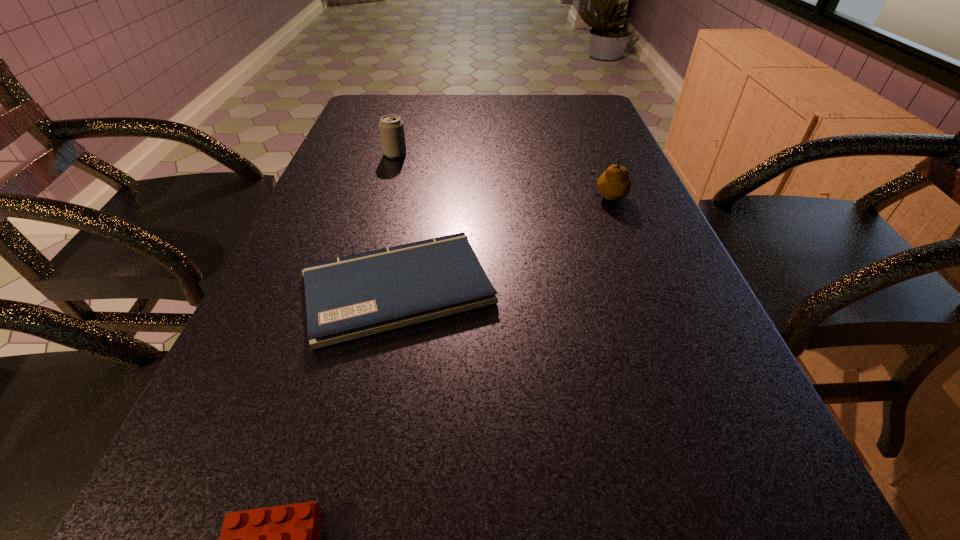
Where is `the farthest object`? The height and width of the screenshot is (540, 960). the farthest object is located at coordinates (391, 127).

Locate an element on the screen. This screenshot has width=960, height=540. the rightmost object is located at coordinates (614, 184).

Where is `the third nearest object`? Image resolution: width=960 pixels, height=540 pixels. the third nearest object is located at coordinates (614, 184).

The width and height of the screenshot is (960, 540). Identify the location of the shortest object. (351, 297).

The image size is (960, 540). Find the location of `paperback book`. paperback book is located at coordinates coord(351,297).

This screenshot has width=960, height=540. In order to click on vacant space located on the back of the can in this screenshot , I will do click(x=402, y=129).

Identify the location of vacant space located on the back of the pear. The image size is (960, 540). pyautogui.click(x=598, y=168).

Where is `vacant space located 0.230m on the right of the paperback book`? The width and height of the screenshot is (960, 540). vacant space located 0.230m on the right of the paperback book is located at coordinates (624, 288).

Where is `can that is at the left edge`? can that is at the left edge is located at coordinates (391, 127).

Image resolution: width=960 pixels, height=540 pixels. In order to click on paperback book at the left edge in this screenshot , I will do `click(351, 297)`.